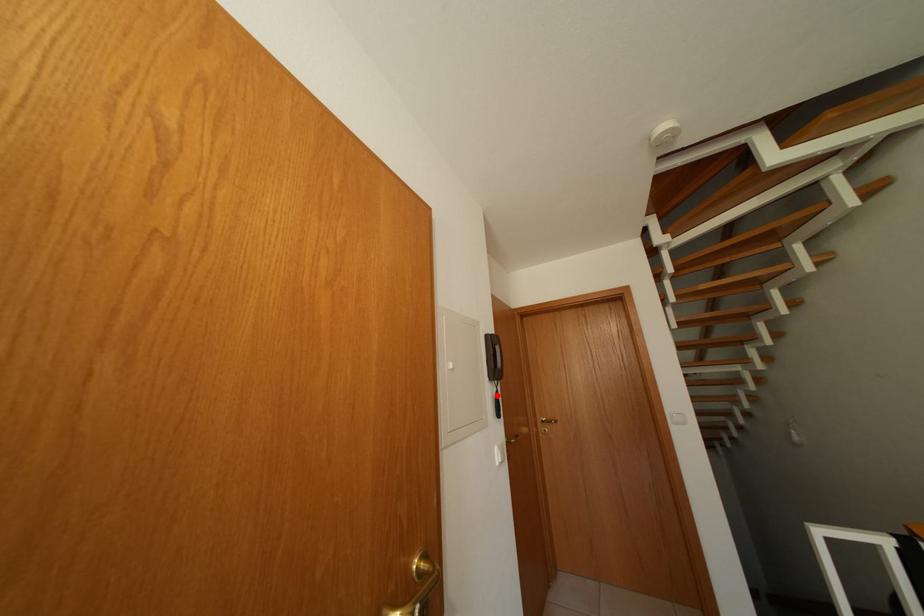
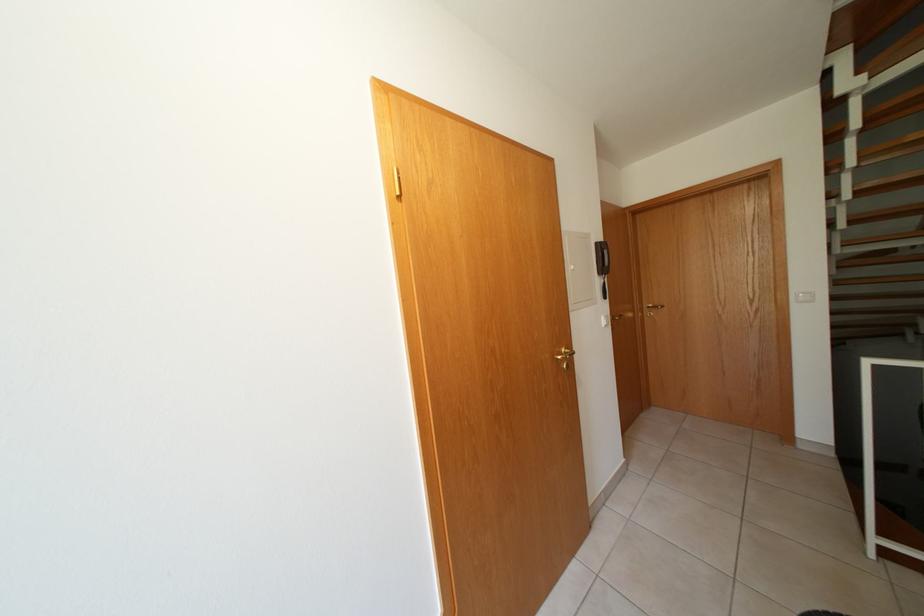
Find the pixel in the second image that matches the highlighted location in the first image.

(606, 286)